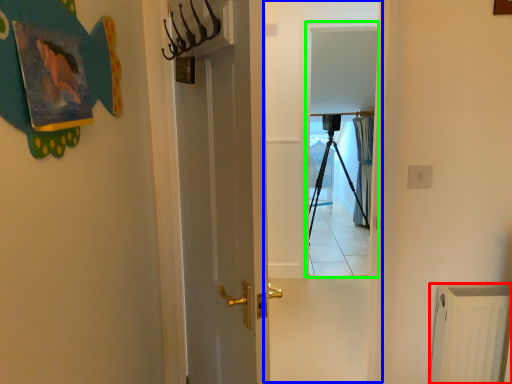
Question: Based on their relative distances, which object is farther from radiator (highlighted by a red box)? Choose from screen door (highlighted by a blue box) and screen door (highlighted by a green box).

Choices:
 (A) screen door
 (B) screen door

Answer: (B)